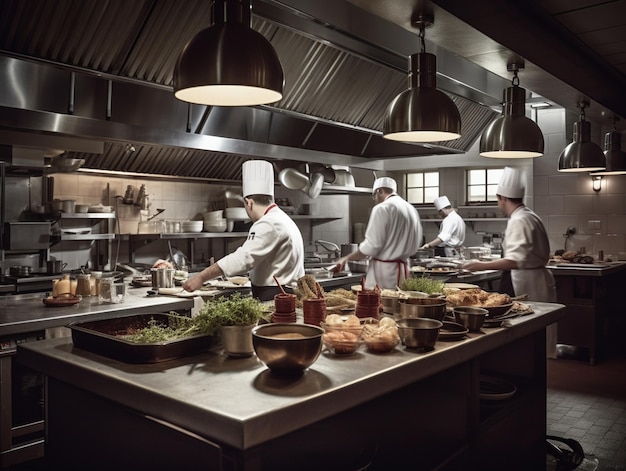
Where is `inside of light fixtures`? This screenshot has height=471, width=626. inside of light fixtures is located at coordinates (218, 98), (416, 139), (510, 155).